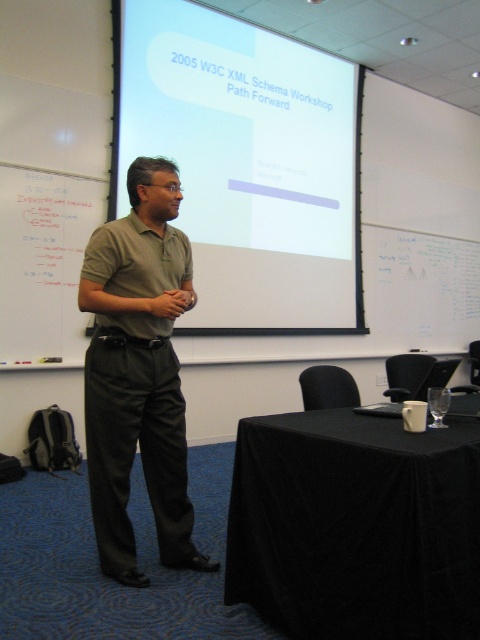
You are a photographer in the conference room. You want to take a photo of the matte khaki polo shirt at center without the black clothed table at lower right appearing in the frame. Is this possible based on their positions?

The black clothed table at lower right is in front of the matte khaki polo shirt at center, so it would block the view. Therefore, it is not possible to take a photo of the matte khaki polo shirt at center without the black clothed table at lower right appearing in the frame.